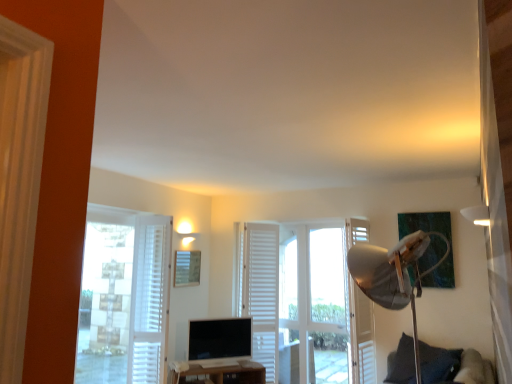
Question: Is wooden picture frame at center smaller than brown wooden tv stand at lower center?

Choices:
 (A) no
 (B) yes

Answer: (B)

Question: Can you confirm if wooden picture frame at center is shorter than brown wooden tv stand at lower center?

Choices:
 (A) yes
 (B) no

Answer: (B)

Question: From a real-world perspective, is wooden picture frame at center positioned over brown wooden tv stand at lower center based on gravity?

Choices:
 (A) yes
 (B) no

Answer: (A)

Question: Can you confirm if wooden picture frame at center is thinner than brown wooden tv stand at lower center?

Choices:
 (A) no
 (B) yes

Answer: (B)

Question: Is wooden picture frame at center taller than brown wooden tv stand at lower center?

Choices:
 (A) no
 (B) yes

Answer: (B)

Question: Considering the positions of point (393, 375) and point (199, 269), is point (393, 375) closer or farther from the camera than point (199, 269)?

Choices:
 (A) farther
 (B) closer

Answer: (B)

Question: Based on their sizes in the image, would you say dark blue fabric pillow at lower right is bigger or smaller than wooden picture frame at center?

Choices:
 (A) big
 (B) small

Answer: (A)

Question: Is dark blue fabric pillow at lower right in front of or behind wooden picture frame at center in the image?

Choices:
 (A) behind
 (B) front

Answer: (B)

Question: Considering the positions of dark blue fabric pillow at lower right and wooden picture frame at center in the image, is dark blue fabric pillow at lower right wider or thinner than wooden picture frame at center?

Choices:
 (A) thin
 (B) wide

Answer: (B)

Question: Considering the positions of point coord(253,365) and point coord(452,362), is point coord(253,365) closer or farther from the camera than point coord(452,362)?

Choices:
 (A) closer
 (B) farther

Answer: (B)

Question: From the image's perspective, is brown wooden tv stand at lower center above or below dark blue fabric pillow at lower right?

Choices:
 (A) below
 (B) above

Answer: (A)

Question: Is brown wooden tv stand at lower center bigger or smaller than dark blue fabric pillow at lower right?

Choices:
 (A) big
 (B) small

Answer: (B)

Question: Is brown wooden tv stand at lower center wider or thinner than dark blue fabric pillow at lower right?

Choices:
 (A) thin
 (B) wide

Answer: (A)

Question: From the image's perspective, relative to white wooden screen door at right, is white textured curtain at left, which is counted as the 2th curtain, starting from the back, above or below?

Choices:
 (A) below
 (B) above

Answer: (B)

Question: Considering the positions of white textured curtain at left, which is counted as the 2th curtain, starting from the back, and white wooden screen door at right in the image, is white textured curtain at left, which is counted as the 2th curtain, starting from the back, wider or thinner than white wooden screen door at right?

Choices:
 (A) thin
 (B) wide

Answer: (B)